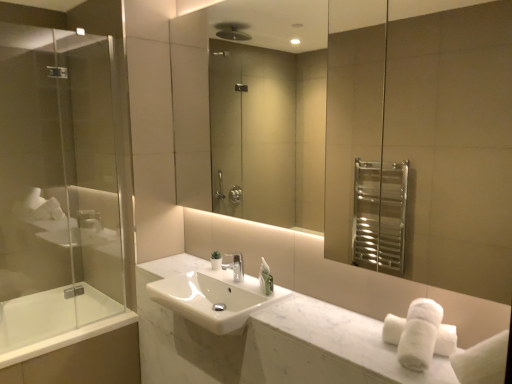
Question: Is transparent glass screen door at left to the right of white glossy bathtub at lower left from the viewer's perspective?

Choices:
 (A) no
 (B) yes

Answer: (B)

Question: From a real-world perspective, does transparent glass screen door at left sit lower than white glossy bathtub at lower left?

Choices:
 (A) no
 (B) yes

Answer: (A)

Question: Is transparent glass screen door at left outside of white glossy bathtub at lower left?

Choices:
 (A) yes
 (B) no

Answer: (A)

Question: From the image's perspective, would you say transparent glass screen door at left is shown under white glossy bathtub at lower left?

Choices:
 (A) no
 (B) yes

Answer: (A)

Question: Is there a large distance between transparent glass screen door at left and white glossy bathtub at lower left?

Choices:
 (A) yes
 (B) no

Answer: (B)

Question: Is white glossy bathtub at lower left located within transparent glass screen door at left?

Choices:
 (A) no
 (B) yes

Answer: (A)

Question: Is silver metallic faucet at center far from transparent glass screen door at left?

Choices:
 (A) yes
 (B) no

Answer: (A)

Question: From a real-world perspective, is silver metallic faucet at center physically above transparent glass screen door at left?

Choices:
 (A) no
 (B) yes

Answer: (A)

Question: From a real-world perspective, is silver metallic faucet at center physically below transparent glass screen door at left?

Choices:
 (A) no
 (B) yes

Answer: (B)

Question: Considering the relative sizes of silver metallic faucet at center and transparent glass screen door at left in the image provided, is silver metallic faucet at center taller than transparent glass screen door at left?

Choices:
 (A) yes
 (B) no

Answer: (B)

Question: Is silver metallic faucet at center closer to camera compared to transparent glass screen door at left?

Choices:
 (A) no
 (B) yes

Answer: (A)

Question: Does silver metallic faucet at center contain transparent glass screen door at left?

Choices:
 (A) yes
 (B) no

Answer: (B)

Question: From a real-world perspective, is white marble counter at center on top of transparent glass screen door at left?

Choices:
 (A) yes
 (B) no

Answer: (B)